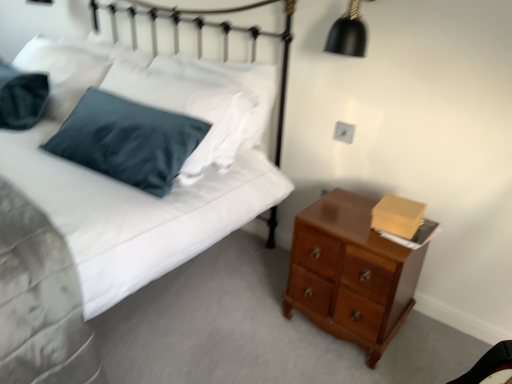
Identify the location of free region on the left part of glossy wood chest of drawers at lower right. The image size is (512, 384). (250, 306).